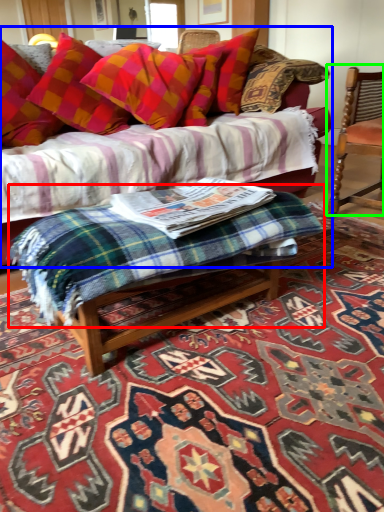
Question: Estimate the real-world distances between objects in this image. Which object is farther from bedding (highlighted by a red box), studio couch (highlighted by a blue box) or chair (highlighted by a green box)?

Choices:
 (A) studio couch
 (B) chair

Answer: (A)